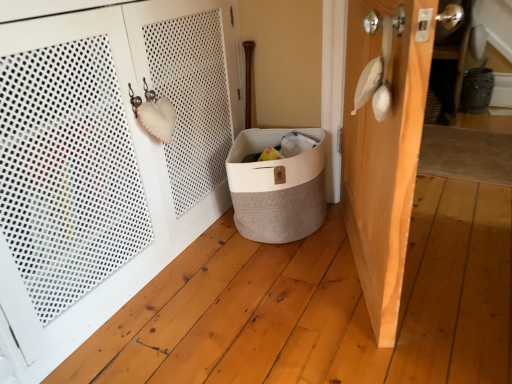
Question: Based on their positions, is wooden door at right, acting as the first door starting from the right, located to the left or right of white woven basket at lower right, placed as the 1th door when sorted from left to right?

Choices:
 (A) right
 (B) left

Answer: (A)

Question: From the image's perspective, relative to white woven basket at lower right, placed as the 1th door when sorted from left to right, is wooden door at right, placed as the 2th door when sorted from left to right, above or below?

Choices:
 (A) above
 (B) below

Answer: (B)

Question: Considering the real-world distances, which object is farthest from the wooden door at right, placed as the 2th door when sorted from left to right?

Choices:
 (A) beige woven laundry basket at center
 (B) white woven basket at lower right, which ranks as the 2th door in right-to-left order

Answer: (B)

Question: Which object is the closest to the wooden door at right, acting as the first door starting from the right?

Choices:
 (A) white woven basket at lower right, which ranks as the 2th door in right-to-left order
 (B) beige woven laundry basket at center

Answer: (B)